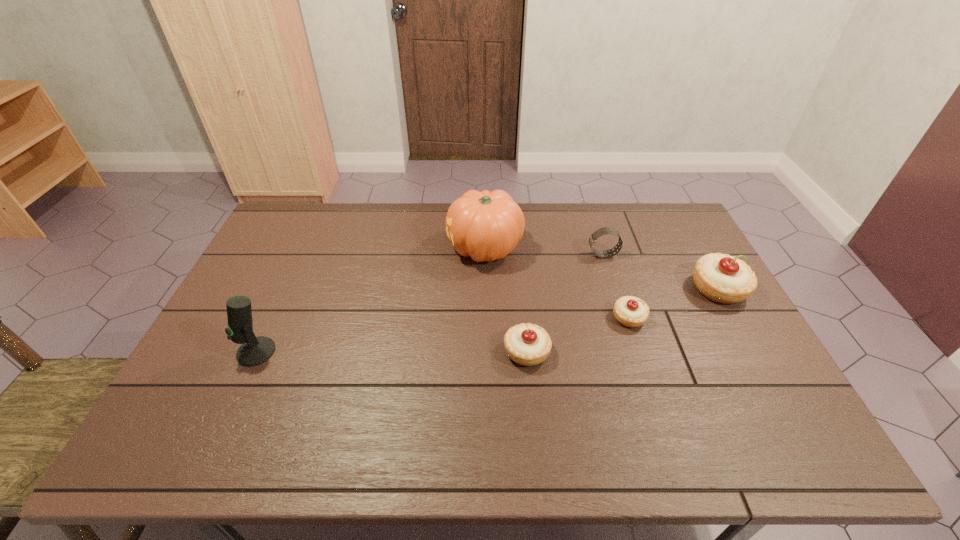
The height and width of the screenshot is (540, 960). Find the location of `the leftmost pastry`. the leftmost pastry is located at coordinates (528, 344).

Find the location of `the second shortest pastry`. the second shortest pastry is located at coordinates (528, 344).

Where is `the shortest pastry`? The image size is (960, 540). the shortest pastry is located at coordinates (630, 311).

The width and height of the screenshot is (960, 540). In order to click on the second pastry from left to right in this screenshot , I will do `click(630, 311)`.

You are a GUI agent. You are given a task and a screenshot of the screen. Output one action in this format:
    pyautogui.click(x=<x>, y=<y>)
    Task: Click on the fourth shortest object
    Image resolution: width=960 pixels, height=540 pixels.
    Given the screenshot: What is the action you would take?
    pyautogui.click(x=722, y=278)

At what (x,y) coordinates should I click in order to perform the action: click on the rightmost object. Please return your answer as a coordinate pair (x, y). This screenshot has width=960, height=540. Looking at the image, I should click on (722, 278).

Find the location of a particular element. This screenshot has height=540, width=960. watch is located at coordinates (594, 236).

At what (x,y) coordinates should I click in order to perform the action: click on pumpkin. Please return your answer as a coordinate pair (x, y). Looking at the image, I should click on (487, 226).

Find the location of a particular element. Image resolution: width=960 pixels, height=540 pixels. the leftmost object is located at coordinates (254, 351).

Locate an element on the screen. Image resolution: width=960 pixels, height=540 pixels. blank space located on the right of the leftmost pastry is located at coordinates (610, 352).